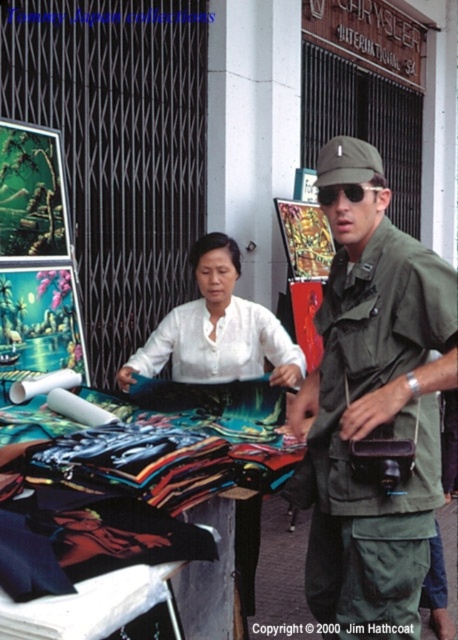
You are a delivery robot with a 1 meter wide package. You need to pass between the green matte uniform at center and the white matte shirt at center. Can you fit through the space between them?

The distance between the green matte uniform at center and the white matte shirt at center is 88.93 centimeters. Since your package is 1 meter wide, which is 100 centimeters, the space is slightly narrower than the package. Therefore, you cannot fit through the space between them.

You are a photographer trying to capture both the green matte uniform at center and the white matte shirt at center in a single frame. Based on their positions, which one should you focus on first to ensure both are in the shot?

The green matte uniform at center is located below the white matte shirt at center, so you should focus on the white matte shirt at center first to ensure both are in the shot.

You are a photographer trying to capture both the green matte uniform at center and the white matte shirt at center in a single frame. Which person should you position closer to the camera to ensure both are in focus?

The green matte uniform at center is smaller than the white matte shirt at center. To ensure both are in focus, position the green matte uniform at center closer to the camera since it is smaller and needs to be magnified to match the size of the white matte shirt at center in the frame.